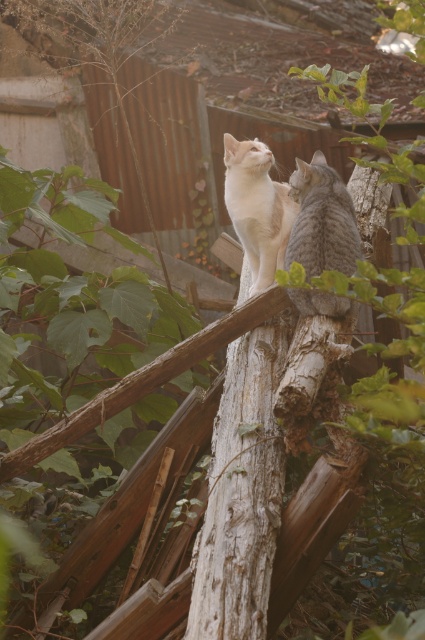
Question: Where is gray rough wood at center located in relation to gray striped cat at upper right in the image?

Choices:
 (A) above
 (B) below

Answer: (B)

Question: Can you confirm if gray rough wood at center is thinner than gray striped cat at upper right?

Choices:
 (A) yes
 (B) no

Answer: (B)

Question: Can you confirm if gray rough wood at center is wider than gray striped cat at upper right?

Choices:
 (A) yes
 (B) no

Answer: (A)

Question: Which object appears closest to the camera in this image?

Choices:
 (A) gray rough wood at center
 (B) gray striped cat at upper right

Answer: (A)

Question: Among these objects, which one is farthest from the camera?

Choices:
 (A) gray striped cat at upper right
 (B) gray rough wood at center
 (C) white fur cat at center

Answer: (C)

Question: Which point is farther from the camera taking this photo?

Choices:
 (A) (255, 252)
 (B) (317, 198)

Answer: (A)